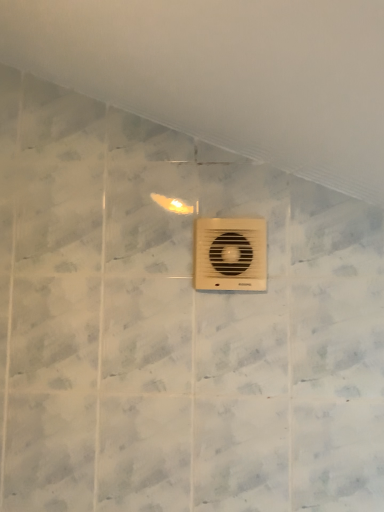
The image size is (384, 512). What do you see at coordinates (230, 254) in the screenshot?
I see `white plastic exhaust fan at center` at bounding box center [230, 254].

Find the location of a particular element. white plastic exhaust fan at center is located at coordinates (230, 254).

What is the approximate width of white plastic exhaust fan at center?

It is 1.14 inches.

Locate an element on the screen. white plastic exhaust fan at center is located at coordinates (230, 254).